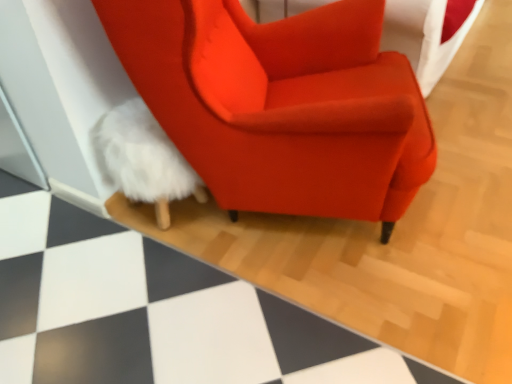
Question: Can white fluffy rug at lower left be found inside white fluffy bean bag at lower left?

Choices:
 (A) yes
 (B) no

Answer: (B)

Question: From a real-world perspective, is white fluffy bean bag at lower left below white fluffy rug at lower left?

Choices:
 (A) yes
 (B) no

Answer: (B)

Question: From a real-world perspective, is white fluffy bean bag at lower left located higher than white fluffy rug at lower left?

Choices:
 (A) no
 (B) yes

Answer: (B)

Question: Does white fluffy bean bag at lower left appear on the left side of white fluffy rug at lower left?

Choices:
 (A) yes
 (B) no

Answer: (A)

Question: Is white fluffy bean bag at lower left oriented towards white fluffy rug at lower left?

Choices:
 (A) no
 (B) yes

Answer: (A)

Question: Is satin orange armchair at center taller or shorter than white fluffy bean bag at lower left?

Choices:
 (A) short
 (B) tall

Answer: (B)

Question: In the image, is satin orange armchair at center positioned in front of or behind white fluffy bean bag at lower left?

Choices:
 (A) front
 (B) behind

Answer: (A)

Question: Visually, is satin orange armchair at center positioned to the left or to the right of white fluffy bean bag at lower left?

Choices:
 (A) left
 (B) right

Answer: (B)

Question: Based on their sizes in the image, would you say satin orange armchair at center is bigger or smaller than white fluffy bean bag at lower left?

Choices:
 (A) big
 (B) small

Answer: (A)

Question: Considering their positions, is white fluffy bean bag at lower left located in front of or behind satin orange armchair at center?

Choices:
 (A) front
 (B) behind

Answer: (B)

Question: From a real-world perspective, is white fluffy bean bag at lower left positioned above or below satin orange armchair at center?

Choices:
 (A) below
 (B) above

Answer: (A)

Question: Would you say white fluffy bean bag at lower left is to the left or to the right of satin orange armchair at center in the picture?

Choices:
 (A) left
 (B) right

Answer: (A)

Question: From the image's perspective, is white fluffy bean bag at lower left positioned above or below satin orange armchair at center?

Choices:
 (A) below
 (B) above

Answer: (A)

Question: From the image's perspective, is white fluffy bean bag at lower left above or below white fluffy rug at lower left?

Choices:
 (A) above
 (B) below

Answer: (B)

Question: Does point (198, 193) appear closer or farther from the camera than point (356, 372)?

Choices:
 (A) closer
 (B) farther

Answer: (B)